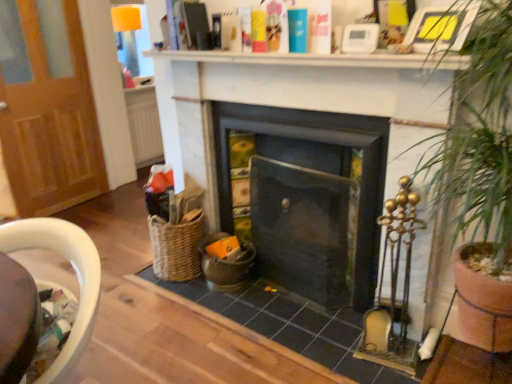
You are a GUI agent. You are given a task and a screenshot of the screen. Output one action in this format:
    pyautogui.click(x=<x>, y=<y>)
    Task: Click on the free location in front of dark gray stone fireplace at center, the 1th fireplace in the right-to-left sequence
    The height and width of the screenshot is (384, 512).
    Given the screenshot: What is the action you would take?
    pyautogui.click(x=302, y=318)